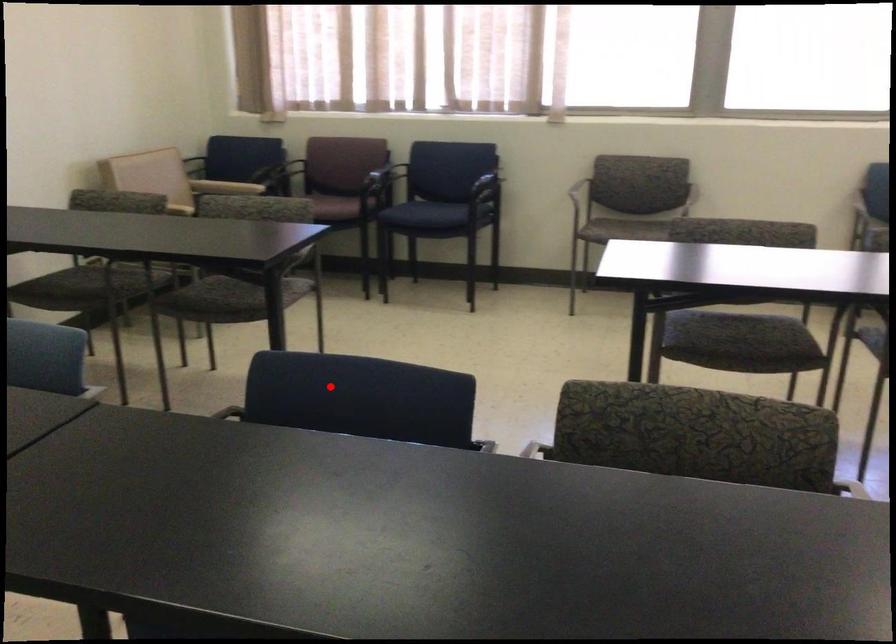
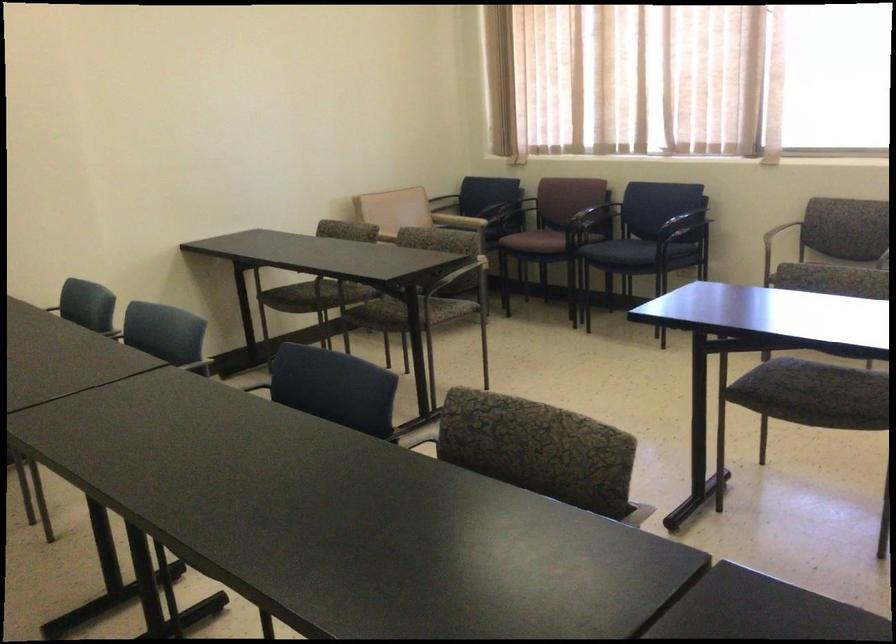
Locate, in the second image, the point that corresponds to the highlighted location in the first image.

(332, 386)